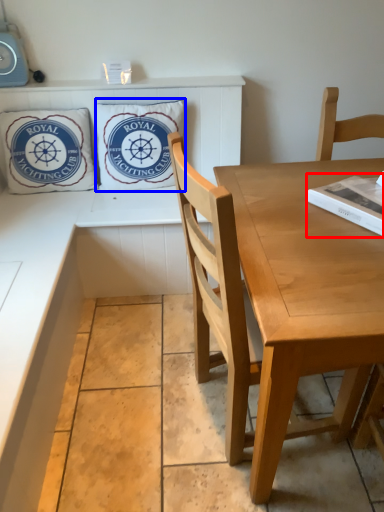
Question: Which of the following is the closest to the observer, magazine (highlighted by a red box) or pillow (highlighted by a blue box)?

Choices:
 (A) magazine
 (B) pillow

Answer: (A)